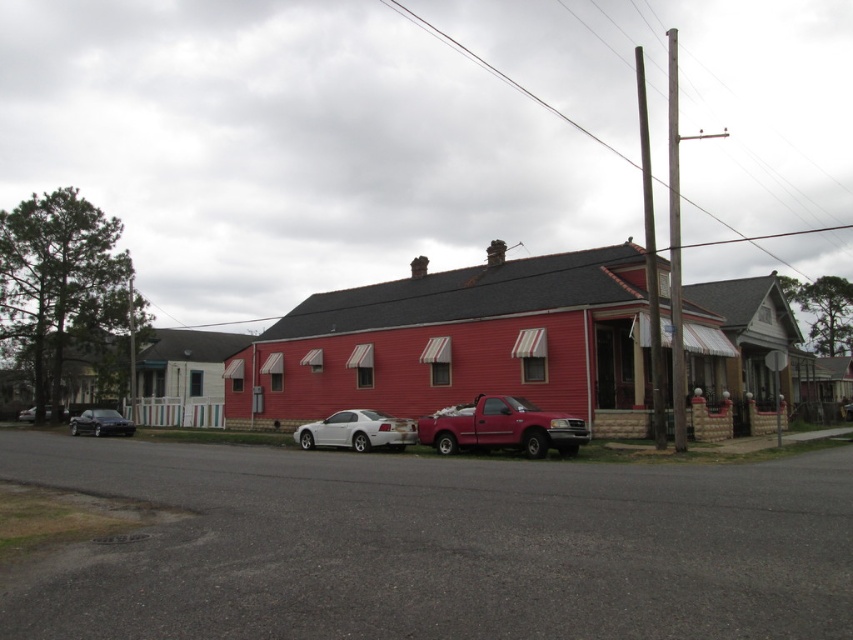
Does white glossy car at center appear under shiny black sedan at lower left?

Incorrect, white glossy car at center is not positioned below shiny black sedan at lower left.

Does point (306, 440) come behind point (109, 417)?

That is False.

The image size is (853, 640). In order to click on white glossy car at center in this screenshot , I will do `click(357, 429)`.

Can you confirm if matte red pickup truck at center is positioned to the right of white glossy car at center?

Indeed, matte red pickup truck at center is positioned on the right side of white glossy car at center.

Who is more forward, (x=492, y=408) or (x=360, y=448)?

Point (x=492, y=408) is in front.

Who is more distant from viewer, (442, 435) or (358, 440)?

Point (358, 440)

This screenshot has height=640, width=853. Identify the location of matte red pickup truck at center. (502, 428).

What do you see at coordinates (502, 428) in the screenshot? The image size is (853, 640). I see `matte red pickup truck at center` at bounding box center [502, 428].

Does point (548, 419) come behind point (27, 408)?

No.

Locate an element on the screen. matte red pickup truck at center is located at coordinates (502, 428).